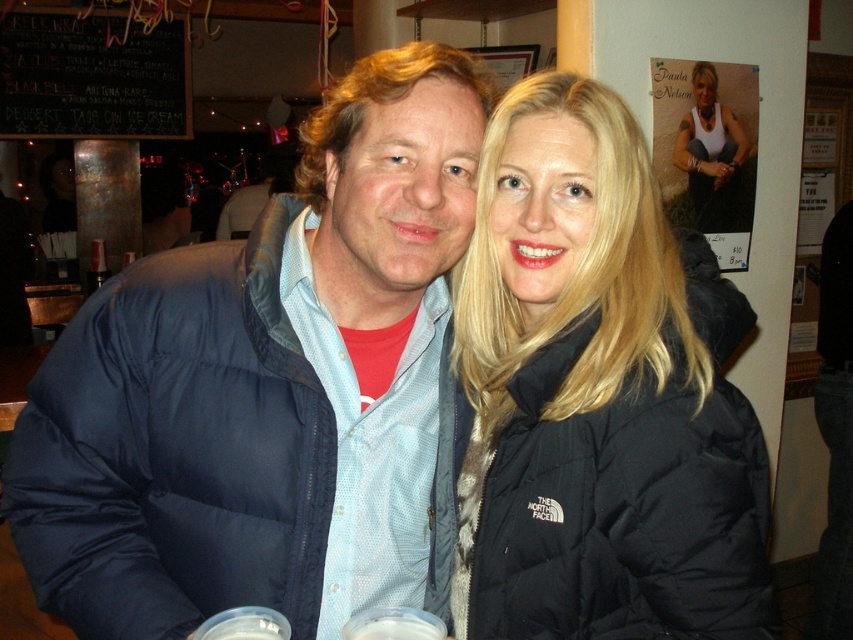
You are at a party and need to find the blue down jacket at center and the black down jacket at center. Which one is lower in position?

The blue down jacket at center is below black down jacket at center, so the blue down jacket at center is lower in position.

You are standing at the origin of a coordinate system placed at the bottom left corner of the image. You see a point marked at coordinate (598,394). What object is located at that coordinate?

The point at coordinate (598,394) indicates the location of the black down jacket at center.

You are standing at the entrance of the room and want to find the blue down jacket at center. According to the coordinates provided, in which direction should you move to locate it?

The blue down jacket at center is located at coordinates point (x=267, y=387). Since you are at the entrance, you should move towards the center of the room to find it.